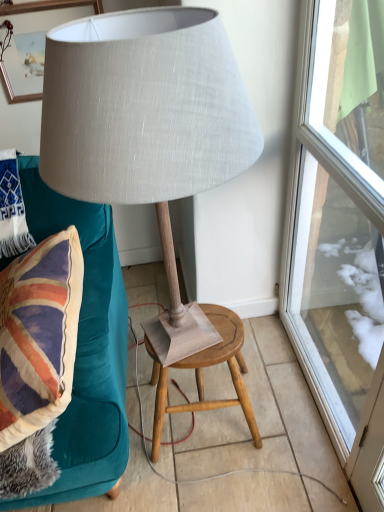
The image size is (384, 512). What do you see at coordinates (32, 42) in the screenshot?
I see `matte wooden picture frame at upper left` at bounding box center [32, 42].

I want to click on white woven pillow at upper left, so click(x=12, y=209).

At what (x,y) coordinates should I click in order to perform the action: click on matte wooden picture frame at upper left. Please return your answer as a coordinate pair (x, y). Looking at the image, I should click on (32, 42).

Consider the image. Considering the relative sizes of transparent glass door at right and matte gray fabric lamp at center in the image provided, is transparent glass door at right smaller than matte gray fabric lamp at center?

Yes, transparent glass door at right is smaller than matte gray fabric lamp at center.

Is transparent glass door at right completely or partially outside of matte gray fabric lamp at center?

Yes, transparent glass door at right is outside of matte gray fabric lamp at center.

Is transparent glass door at right placed right next to matte gray fabric lamp at center?

There is a gap between transparent glass door at right and matte gray fabric lamp at center.

Is transparent glass door at right oriented towards matte gray fabric lamp at center?

Yes, transparent glass door at right is oriented towards matte gray fabric lamp at center.

Consider the image. Does white woven pillow at upper left have a larger size compared to wooden stool at center?

Actually, white woven pillow at upper left might be smaller than wooden stool at center.

Which object is wider, white woven pillow at upper left or wooden stool at center?

wooden stool at center is wider.

Is the position of white woven pillow at upper left less distant than that of wooden stool at center?

No, white woven pillow at upper left is further to the viewer.

From the image's perspective, relative to white woven pillow at upper left, is matte wooden picture frame at upper left above or below?

Based on their image positions, matte wooden picture frame at upper left is located above white woven pillow at upper left.

Between matte wooden picture frame at upper left and white woven pillow at upper left, which one appears on the left side from the viewer's perspective?

From the viewer's perspective, white woven pillow at upper left appears more on the left side.

Where is `picture frame on the right of white woven pillow at upper left`? picture frame on the right of white woven pillow at upper left is located at coordinates (32, 42).

Is point (40, 94) less distant than point (14, 182)?

That is False.

From the image's perspective, is velvet teal sofa at left located above or below wooden stool at center?

velvet teal sofa at left is situated higher than wooden stool at center in the image.

Which of these two, velvet teal sofa at left or wooden stool at center, is smaller?

With smaller size is wooden stool at center.

From a real-world perspective, is velvet teal sofa at left on wooden stool at center?

Yes, from a real-world perspective, velvet teal sofa at left is on top of wooden stool at center.

Visually, is velvet teal sofa at left positioned to the left or to the right of wooden stool at center?

In the image, velvet teal sofa at left appears on the left side of wooden stool at center.

In the scene shown: How much distance is there between matte gray fabric lamp at center and wooden stool at center?

77.35 centimeters.

Could you tell me if matte gray fabric lamp at center is facing wooden stool at center?

No, matte gray fabric lamp at center is not aimed at wooden stool at center.

Which of these two, matte gray fabric lamp at center or wooden stool at center, is bigger?

With larger size is matte gray fabric lamp at center.

Does matte gray fabric lamp at center lie in front of wooden stool at center?

Yes, matte gray fabric lamp at center is closer to the camera.

From a real-world perspective, is matte wooden picture frame at upper left above or below transparent glass door at right?

From a real-world perspective, matte wooden picture frame at upper left is physically above transparent glass door at right.

Is matte wooden picture frame at upper left touching transparent glass door at right?

matte wooden picture frame at upper left is not next to transparent glass door at right, and they're not touching.

Between matte wooden picture frame at upper left and transparent glass door at right, which one has less height?

Standing shorter between the two is matte wooden picture frame at upper left.

From the image's perspective, which is below, matte wooden picture frame at upper left or transparent glass door at right?

transparent glass door at right is shown below in the image.

You are a GUI agent. You are given a task and a screenshot of the screen. Output one action in this format:
    pyautogui.click(x=<x>, y=<y>)
    Task: Click on the stool below the matte wooden picture frame at upper left (from the image's perspective)
    This screenshot has width=384, height=512.
    Given the screenshot: What is the action you would take?
    pyautogui.click(x=202, y=374)

Is wooden stool at center at the left side of matte wooden picture frame at upper left?

No.

Could you tell me if wooden stool at center is turned towards matte wooden picture frame at upper left?

No, wooden stool at center does not turn towards matte wooden picture frame at upper left.

Can you tell me how much wooden stool at center and matte wooden picture frame at upper left differ in facing direction?

There is a 1.75-degree angle between the facing directions of wooden stool at center and matte wooden picture frame at upper left.

The image size is (384, 512). What are the coordinates of `lamp that appears behind the transparent glass door at right` in the screenshot? It's located at (x=145, y=113).

At what (x,y) coordinates should I click in order to perform the action: click on pillow above the wooden stool at center (from a real-world perspective). Please return your answer as a coordinate pair (x, y). The image size is (384, 512). Looking at the image, I should click on (12, 209).

Looking at the image, which one is located further to velvet teal sofa at left, matte gray fabric lamp at center or wooden stool at center?

matte gray fabric lamp at center is further to velvet teal sofa at left.

Looking at the image, which one is located further to velvet teal sofa at left, wooden stool at center or transparent glass door at right?

transparent glass door at right is further to velvet teal sofa at left.

From the image, which object appears to be nearer to matte gray fabric lamp at center, white woven pillow at upper left or matte wooden picture frame at upper left?

white woven pillow at upper left is closer to matte gray fabric lamp at center.

When comparing their distances from white woven pillow at upper left, does transparent glass door at right or velvet teal sofa at left seem closer?

velvet teal sofa at left lies closer to white woven pillow at upper left than the other object.

Looking at the image, which one is located further to wooden stool at center, matte gray fabric lamp at center or transparent glass door at right?

matte gray fabric lamp at center is positioned further to the anchor wooden stool at center.

From the image, which object appears to be nearer to velvet teal sofa at left, transparent glass door at right or white woven pillow at upper left?

white woven pillow at upper left.

From the image, which object appears to be farther from matte wooden picture frame at upper left, transparent glass door at right or white woven pillow at upper left?

transparent glass door at right is positioned further to the anchor matte wooden picture frame at upper left.

Which object lies further to the anchor point wooden stool at center, velvet teal sofa at left or white woven pillow at upper left?

Among the two, white woven pillow at upper left is located further to wooden stool at center.

Identify the location of furniture located between matte gray fabric lamp at center and matte wooden picture frame at upper left in the depth direction. Image resolution: width=384 pixels, height=512 pixels. (86, 349).

Find the location of a particular element. The height and width of the screenshot is (512, 384). pillow between matte wooden picture frame at upper left and velvet teal sofa at left in the up-down direction is located at coordinates (12, 209).

The width and height of the screenshot is (384, 512). Identify the location of pillow between matte wooden picture frame at upper left and wooden stool at center from top to bottom. (12, 209).

I want to click on furniture located between matte gray fabric lamp at center and wooden stool at center in the depth direction, so click(86, 349).